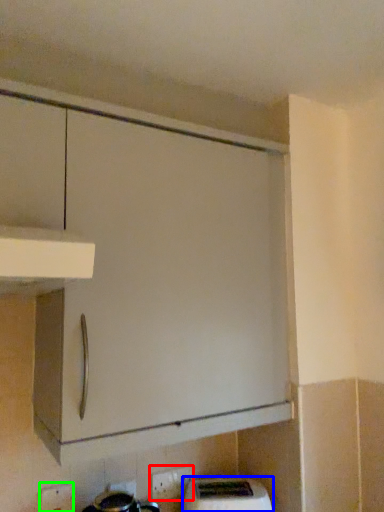
Question: Which is nearer to the electric outlet (highlighted by a red box)? home appliance (highlighted by a blue box) or electric outlet (highlighted by a green box).

Choices:
 (A) home appliance
 (B) electric outlet

Answer: (A)